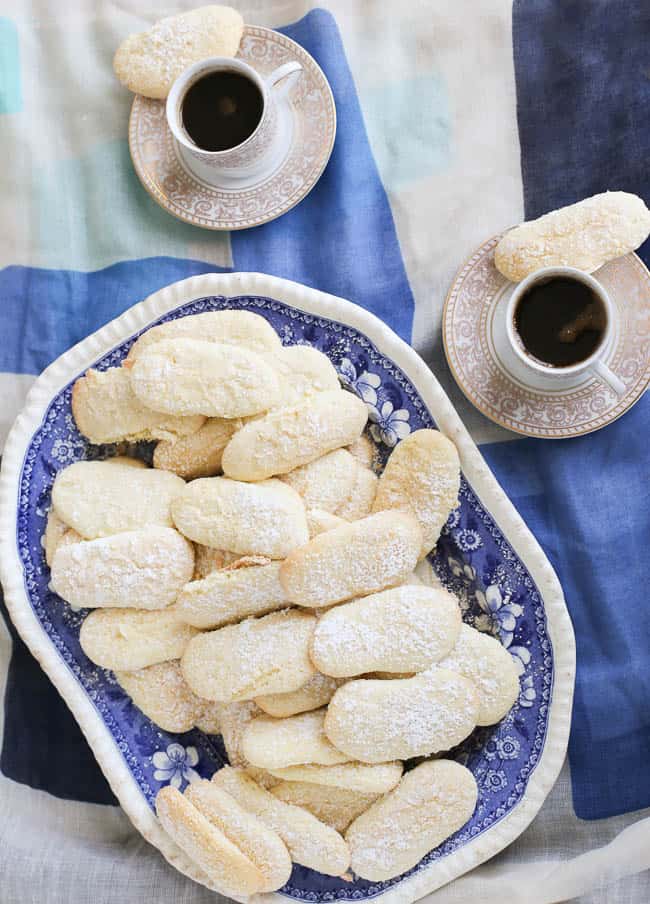
At what (x,y) coordinates should I click in order to perform the action: click on teacup handle. Please return your answer as a coordinate pair (x, y). Looking at the image, I should click on (608, 375), (283, 70).